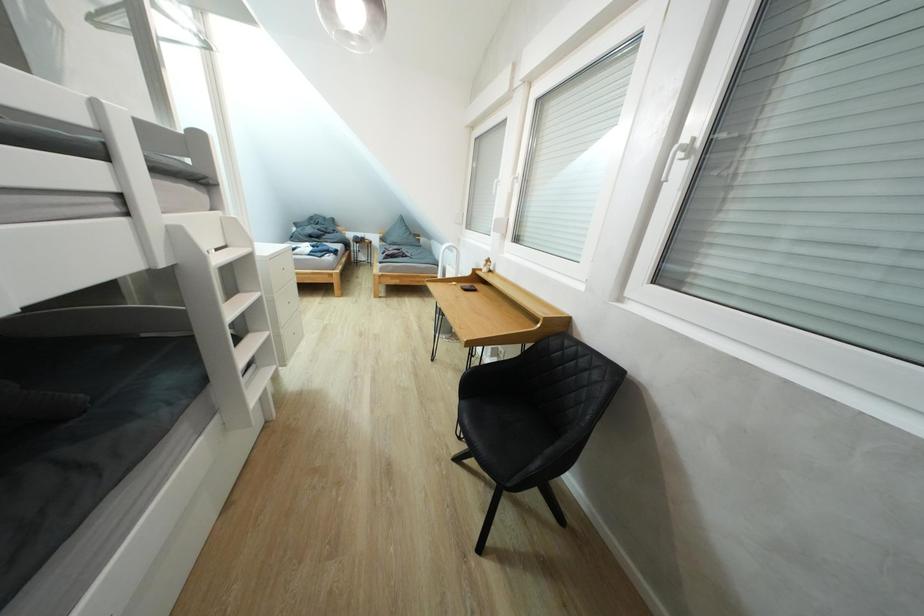
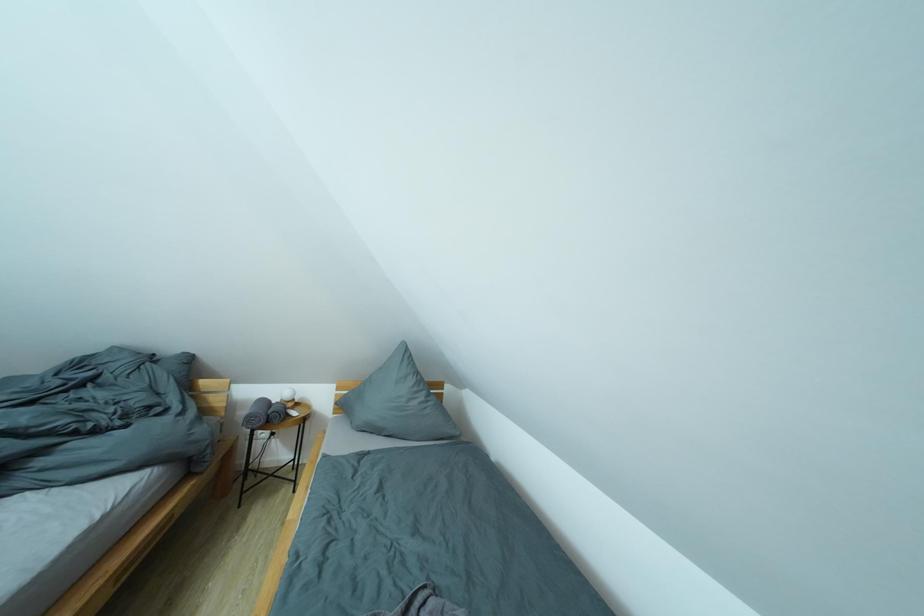
Question: Which direction would the cameraman need to move to produce the second image? Reply with the corresponding letter.

Choices:
 (A) Left
 (B) Right
 (C) Forward
 (D) Backward

Answer: (C)